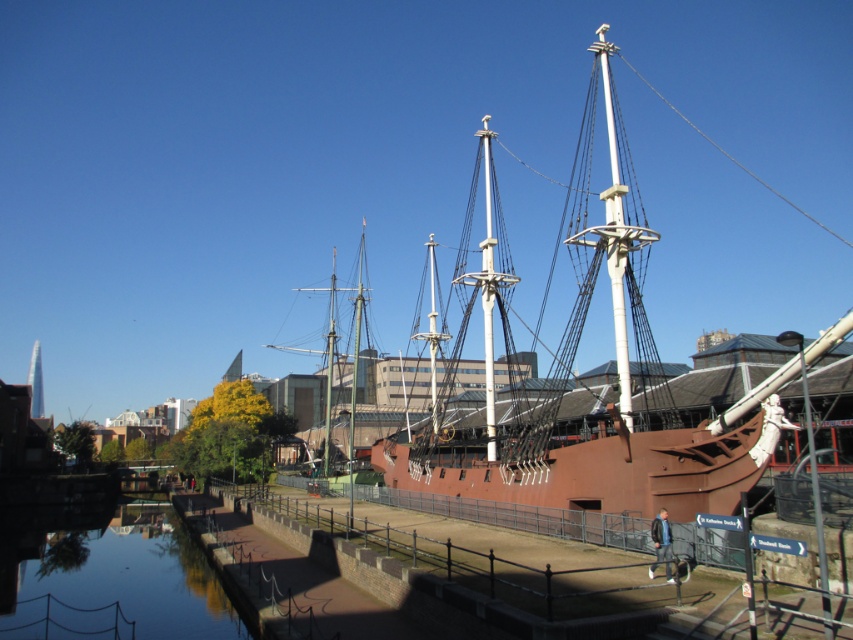
Consider the image. You are standing on the walkway near the ship and want to take a photo of the smooth water at lower left and rustic wood mast at center. Which object should you focus on first to ensure both are in frame?

You should focus on the rustic wood mast at center first because it is farther away from the viewer than the smooth water at lower left, so adjusting focus starting from the distant object will help capture both in the frame.

You are a tour guide explaining the ship to visitors. You mention the smooth water at lower left and the rustic wood mast at center. Which one is smaller in size?

The smooth water at lower left has a smaller size compared to rustic wood mast at center, so the smooth water at lower left is smaller in size.

You are a tour guide explaining the historical ship to visitors. Pointing to the brown wooden ship at center and the smooth water at lower left, you want to describe their positions relative to each other. How would you phrase this?

The brown wooden ship at center is positioned to the right of the smooth water at lower left, meaning the water is located to the left side of the ship in the image.